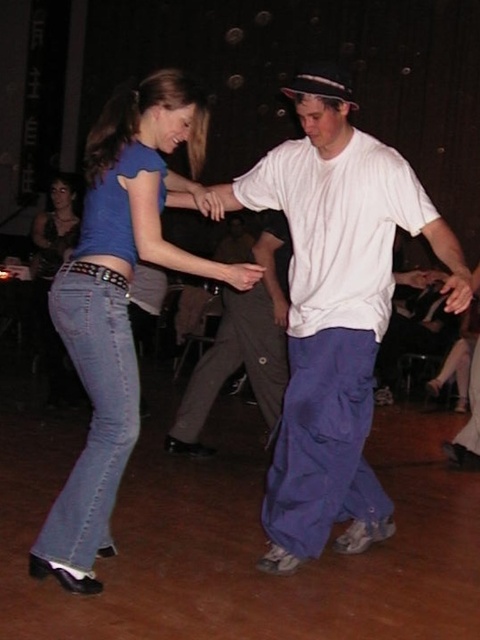
Is denim jeans at center further to the viewer compared to dark gray pants at center?

That is False.

Can you confirm if denim jeans at center is positioned above dark gray pants at center?

Correct, denim jeans at center is located above dark gray pants at center.

Which is behind, point (62, 342) or point (229, 340)?

Positioned behind is point (229, 340).

The image size is (480, 640). I want to click on denim jeans at center, so click(x=120, y=300).

Who is more distant from viewer, (101, 380) or (63, 211)?

Positioned behind is point (63, 211).

Does point (84, 230) come farther from viewer compared to point (51, 275)?

No, (84, 230) is in front of (51, 275).

What are the coordinates of `denim jeans at center` in the screenshot? It's located at (120, 300).

Between denim jeans at center and blue cotton pants at center, which one is positioned higher?

denim jeans at center

Can you confirm if denim jeans at center is positioned to the left of blue cotton pants at center?

Correct, you'll find denim jeans at center to the left of blue cotton pants at center.

This screenshot has height=640, width=480. Identify the location of denim jeans at center. pos(120,300).

I want to click on denim jeans at center, so (x=120, y=300).